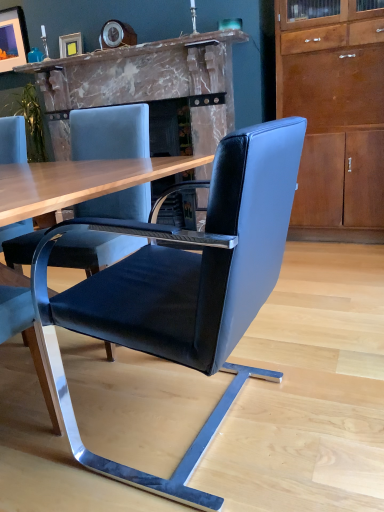
You are a GUI agent. You are given a task and a screenshot of the screen. Output one action in this format:
    pyautogui.click(x=<x>, y=<y>)
    Task: Click on the vacant region below black leather chair at center (from a real-world perspective)
    This screenshot has height=512, width=384.
    Given the screenshot: What is the action you would take?
    pyautogui.click(x=182, y=418)